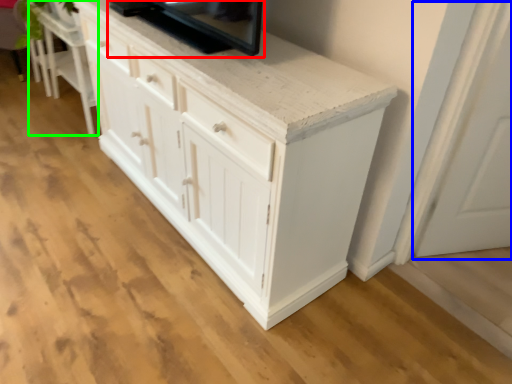
Question: Which object is the farthest from appliance (highlighted by a red box)? Choose among these: glass door (highlighted by a blue box) or vanity (highlighted by a green box).

Choices:
 (A) glass door
 (B) vanity

Answer: (B)